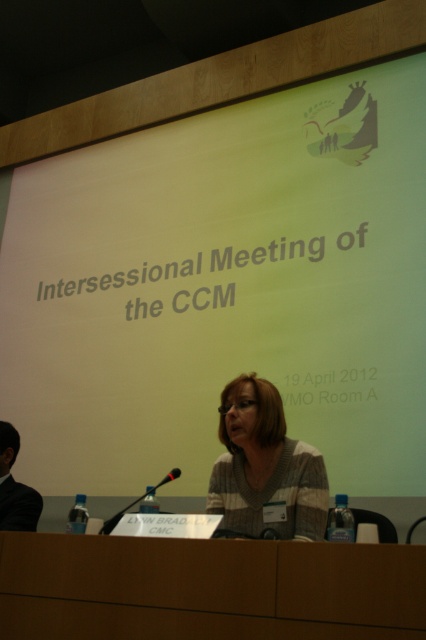
You are an event organizer who needs to set up a new microphone stand for the speaker. The stand requires a space of 1.5 meters to be placed between the green matte projection screen at upper center and the black suit at left. Is there enough space between them to accommodate the microphone stand?

The distance between the green matte projection screen at upper center and the black suit at left is 1.35 meters, which is less than the required 1.5 meters. Therefore, there isn not enough space to place the microphone stand between them.

You are standing in the conference room and need to locate the green matte projection screen at upper center. According to the coordinates provided, where exactly should you look to find it?

The green matte projection screen at upper center is located at point coordinates 0.452 in the x axis and 0.526 in the y axis.

You are attending a virtual meeting and need to focus on the speaker wearing the black suit at left. However, the green matte projection screen at upper center is blocking your view. Can you move your virtual camera to see both the speaker and the screen clearly?

The green matte projection screen at upper center is further to the viewer than the black suit at left, so moving the virtual camera slightly backward might allow you to see both the speaker and the screen without obstruction.